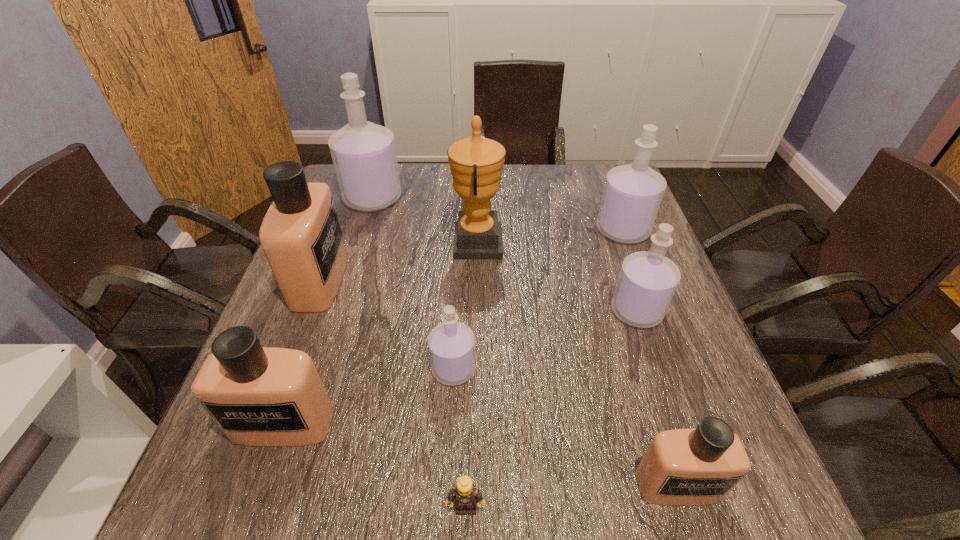
Locate an element on the screen. Image resolution: width=960 pixels, height=540 pixels. vacant space located on the left of the nearest purple perfume is located at coordinates (262, 369).

At what (x,y) coordinates should I click in order to perform the action: click on object that is at the far edge. Please return your answer as a coordinate pair (x, y). The width and height of the screenshot is (960, 540). Looking at the image, I should click on (363, 153).

You are a GUI agent. You are given a task and a screenshot of the screen. Output one action in this format:
    pyautogui.click(x=<x>, y=<y>)
    Task: Click on the perfume at the near edge
    The height and width of the screenshot is (540, 960).
    Given the screenshot: What is the action you would take?
    pyautogui.click(x=682, y=467)

This screenshot has height=540, width=960. In order to click on Lego present at the near edge in this screenshot , I will do `click(466, 496)`.

Locate an element on the screen. The image size is (960, 540). object located in the far left corner section of the desktop is located at coordinates (363, 153).

Where is `object that is at the near right corner`? object that is at the near right corner is located at coordinates (682, 467).

Identify the location of free space at the far edge of the desktop. This screenshot has width=960, height=540. (522, 206).

This screenshot has width=960, height=540. Identify the location of free space at the near edge. (554, 470).

The image size is (960, 540). Find the location of `vacant space at the left edge`. vacant space at the left edge is located at coordinates (367, 216).

Locate an element on the screen. This screenshot has width=960, height=540. vacant space at the right edge of the desktop is located at coordinates (631, 252).